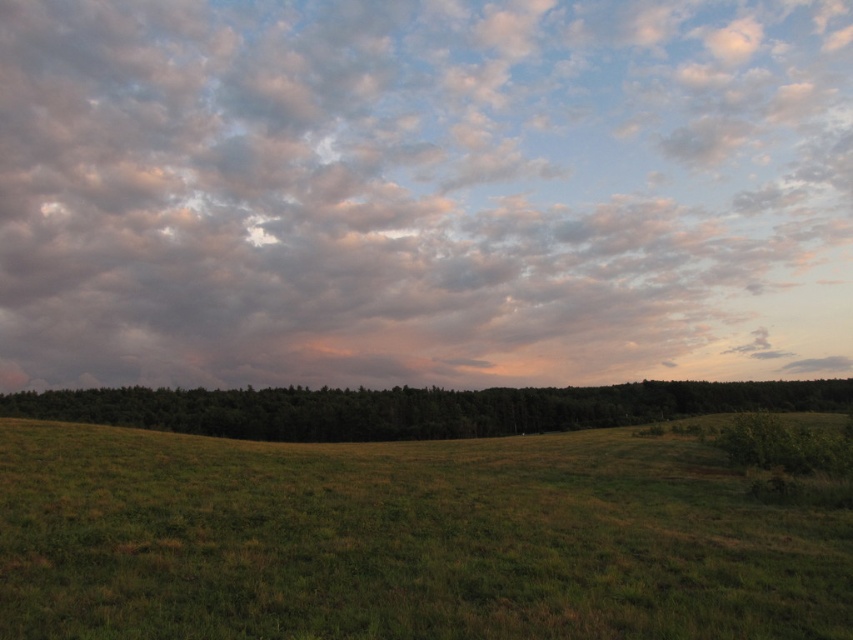
Question: Which point is closer to the camera?

Choices:
 (A) green leafy forest at center
 (B) green grassy field at lower center
 (C) cloudy sky at upper center

Answer: (B)

Question: Which of the following is the closest to the observer?

Choices:
 (A) (473, 428)
 (B) (744, 243)
 (C) (515, 540)

Answer: (C)

Question: Which of the following is the farthest from the observer?

Choices:
 (A) (628, 468)
 (B) (97, 172)

Answer: (B)

Question: Can you confirm if cloudy sky at upper center is wider than green grassy field at lower center?

Choices:
 (A) yes
 (B) no

Answer: (A)

Question: Can you confirm if cloudy sky at upper center is thinner than green grassy field at lower center?

Choices:
 (A) no
 (B) yes

Answer: (A)

Question: Is cloudy sky at upper center further to camera compared to green leafy forest at center?

Choices:
 (A) no
 (B) yes

Answer: (B)